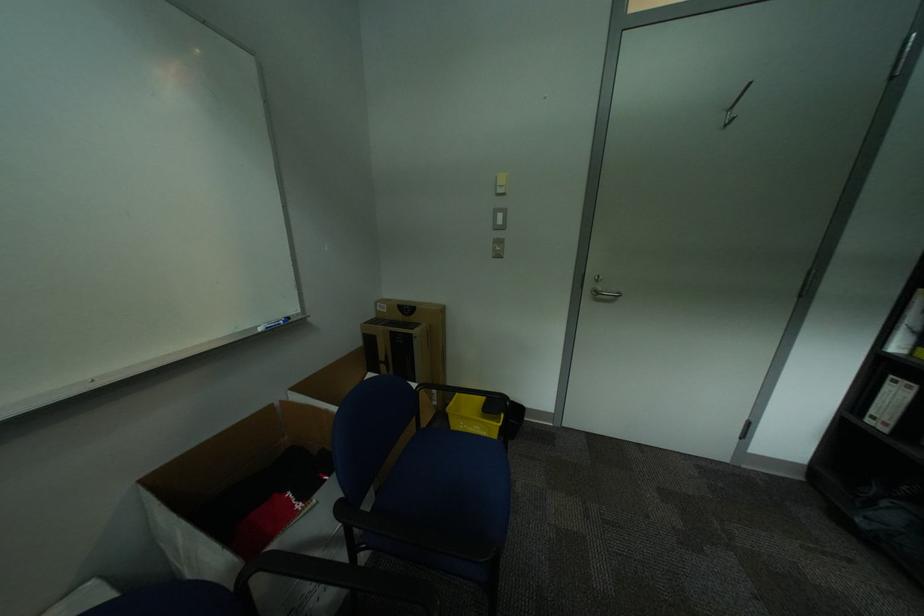
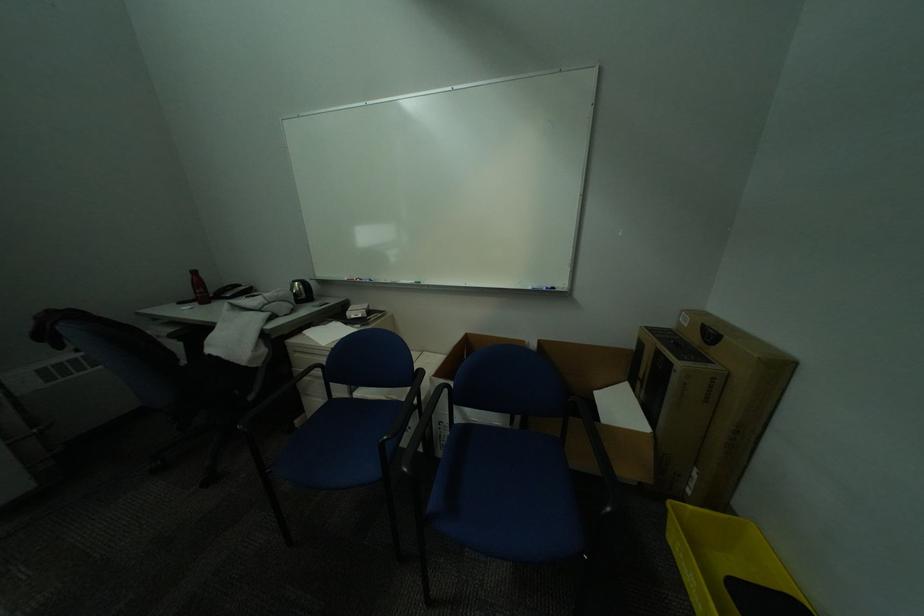
The point at (463,405) is marked in the first image. Where is the corresponding point in the second image?

(701, 508)